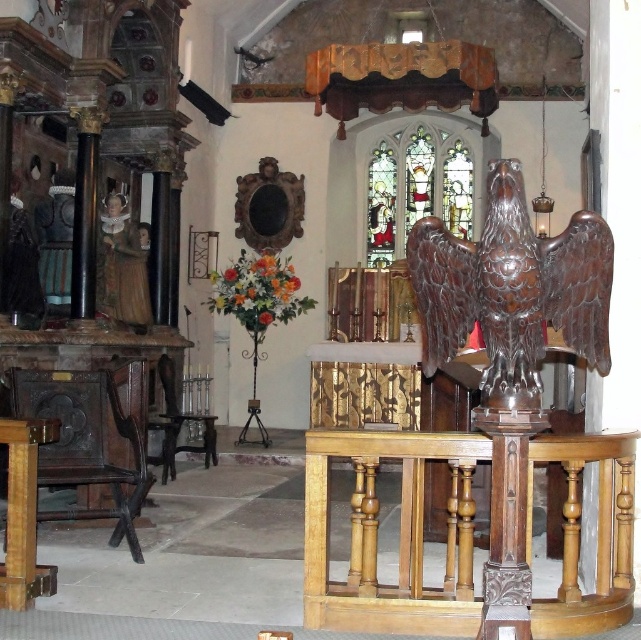
The image size is (641, 640). Describe the element at coordinates (399, 534) in the screenshot. I see `light brown polished wood table at center` at that location.

Is point (324, 451) positioned after point (29, 589)?

No, (324, 451) is closer to viewer.

You are a GUI agent. You are given a task and a screenshot of the screen. Output one action in this format:
    pyautogui.click(x=<x>, y=<y>)
    Task: Click on the light brown polished wood table at center
    This screenshot has width=641, height=640.
    Given the screenshot: What is the action you would take?
    pyautogui.click(x=399, y=534)

Which is above, light brown polished wood table at center or shiny brown eagle at center?

shiny brown eagle at center is above.

This screenshot has height=640, width=641. Describe the element at coordinates (399, 534) in the screenshot. I see `light brown polished wood table at center` at that location.

The image size is (641, 640). I want to click on light brown polished wood table at center, so click(399, 534).

Consider the image. Which is below, shiny brown eagle at center or wooden table at lower left?

wooden table at lower left is below.

Is point (585, 300) positioned after point (35, 493)?

No, (585, 300) is closer to viewer.

Who is more distant from viewer, (585, 260) or (4, 428)?

The point (4, 428) is behind.

Where is `shiny brown eagle at center`? This screenshot has height=640, width=641. shiny brown eagle at center is located at coordinates (512, 291).